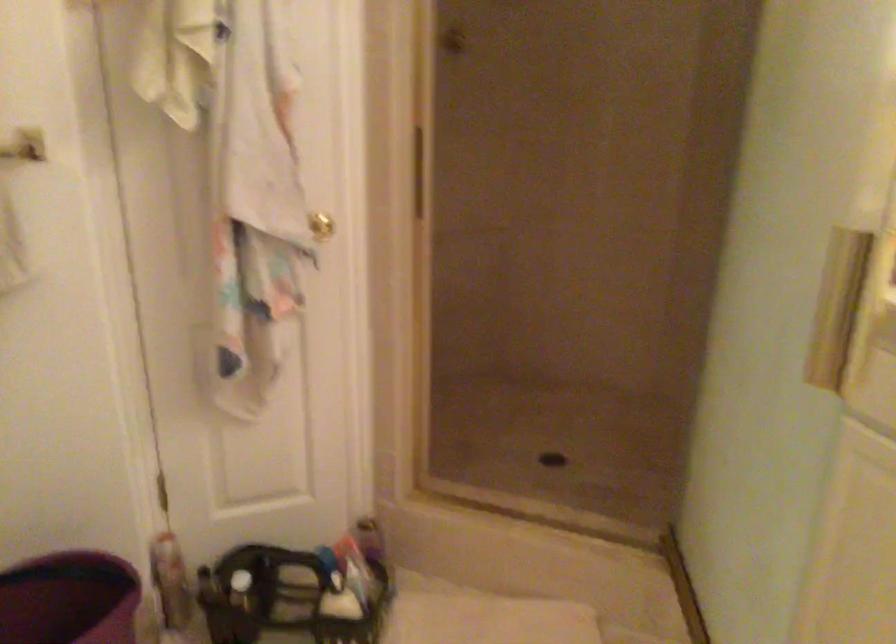
Locate an element on the screen. The height and width of the screenshot is (644, 896). black shower caddy is located at coordinates (281, 598).